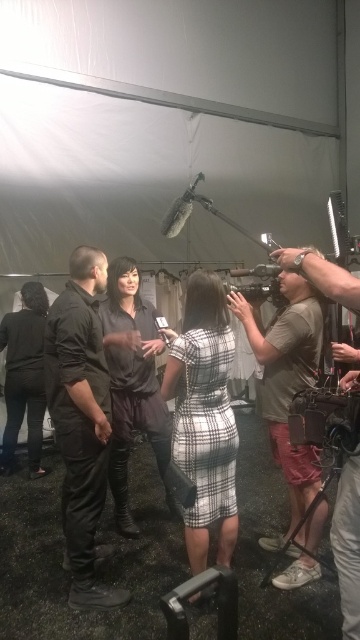
You are a photographer standing at the position of the camera. You want to grab the black leather jacket at left to adjust its placement for a better shot. Can you reach it without moving from your current position?

The black leather jacket at left and camera are 12.30 feet apart from each other, so you cannot reach it without moving from your current position.

You are an event organizer arranging a photoshoot under the large white tent. You need to ensure that the plaid fabric dress at center and the khaki cotton shirt at right are visible in the shot. Based on their positions, which clothing item is covering part of the other?

The plaid fabric dress at center is positioned over the khaki cotton shirt at right, so it is covering part of the khaki cotton shirt at right.

In the image of the media interview setup under a large white tent, there is a woman in a black and white checkered dress holding a microphone and facing someone in a dark outfit. To the right side of the frame, there is a point at coordinates (24, 378). What object is located at that point?

The point at coordinates (24, 378) corresponds to the black leather jacket at left.